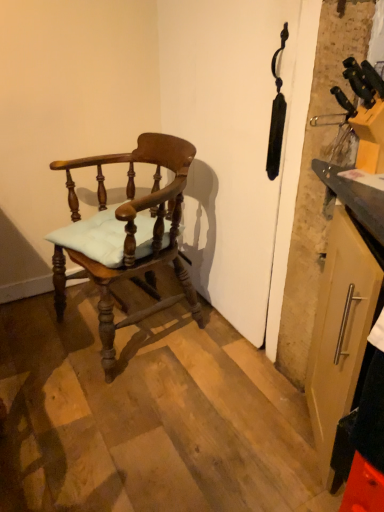
The width and height of the screenshot is (384, 512). What do you see at coordinates (340, 332) in the screenshot?
I see `matte silver handle on the right` at bounding box center [340, 332].

Image resolution: width=384 pixels, height=512 pixels. Identify the location of matte silver handle on the right. (340, 332).

Measure the distance between point [331,345] and camera.

They are 1.17 meters apart.

The image size is (384, 512). What do you see at coordinates (132, 234) in the screenshot?
I see `matte wood chair at left` at bounding box center [132, 234].

In order to face matte wood chair at left, should I rotate leftwards or rightwards?

Turn left by 8.425 degrees to look at matte wood chair at left.

At what (x,y) coordinates should I click in order to perform the action: click on matte wood chair at left. Please return your answer as a coordinate pair (x, y). Looking at the image, I should click on (132, 234).

The width and height of the screenshot is (384, 512). Find the location of `matte silver handle on the right`. matte silver handle on the right is located at coordinates (340, 332).

Between matte silver handle on the right and matte wood chair at left, which one appears on the left side from the viewer's perspective?

matte wood chair at left.

Considering their positions, is matte silver handle on the right located in front of or behind matte wood chair at left?

Clearly, matte silver handle on the right is in front of matte wood chair at left.

Is point (360, 236) closer or farther from the camera than point (128, 196)?

Point (360, 236) is closer to the camera than point (128, 196).

Based on the photo, from the image's perspective, is matte silver handle on the right below matte wood chair at left?

Yes, from the image's perspective, matte silver handle on the right is below matte wood chair at left.

From a real-world perspective, is matte silver handle on the right physically located above or below matte wood chair at left?

In terms of real-world spatial position, matte silver handle on the right is above matte wood chair at left.

Does matte silver handle on the right have a lesser width compared to matte wood chair at left?

Indeed, matte silver handle on the right has a lesser width compared to matte wood chair at left.

Is matte silver handle on the right shorter than matte wood chair at left?

Indeed, matte silver handle on the right has a lesser height compared to matte wood chair at left.

In terms of size, does matte silver handle on the right appear bigger or smaller than matte wood chair at left?

In the image, matte silver handle on the right appears to be smaller than matte wood chair at left.

Would you say matte wood chair at left is part of matte silver handle on the right's contents?

Actually, matte wood chair at left is outside matte silver handle on the right.

Is matte silver handle on the right far from matte wood chair at left?

matte silver handle on the right is near matte wood chair at left, not far away.

Is matte silver handle on the right facing towards matte wood chair at left?

No, matte silver handle on the right is not oriented towards matte wood chair at left.

How different are the orientations of matte silver handle on the right and matte wood chair at left in degrees?

There is a 9.81-degree angle between the facing directions of matte silver handle on the right and matte wood chair at left.

How distant is matte silver handle on the right from matte wood chair at left?

matte silver handle on the right is 32.03 inches from matte wood chair at left.

Identify the location of chair above the matte silver handle on the right (from the image's perspective). Image resolution: width=384 pixels, height=512 pixels. (132, 234).

Between matte wood chair at left and matte silver handle on the right, which one appears on the right side from the viewer's perspective?

matte silver handle on the right.

Relative to matte silver handle on the right, is matte wood chair at left in front or behind?

matte wood chair at left is behind matte silver handle on the right.

Is point (157, 141) closer or farther from the camera than point (318, 436)?

Point (157, 141) appears to be farther away from the viewer than point (318, 436).

From the image's perspective, is matte wood chair at left located beneath matte silver handle on the right?

Incorrect, from the image's perspective, matte wood chair at left is higher than matte silver handle on the right.

From a real-world perspective, is matte wood chair at left physically below matte silver handle on the right?

Indeed, from a real-world perspective, matte wood chair at left is positioned beneath matte silver handle on the right.

Looking at this image, between matte wood chair at left and matte silver handle on the right, which one has smaller width?

matte silver handle on the right.

Considering the sizes of objects matte wood chair at left and matte silver handle on the right in the image provided, who is shorter, matte wood chair at left or matte silver handle on the right?

Standing shorter between the two is matte silver handle on the right.

Based on the photo, can you confirm if matte wood chair at left is bigger than matte silver handle on the right?

Yes, matte wood chair at left is bigger than matte silver handle on the right.

Is matte wood chair at left outside of matte silver handle on the right?

Indeed, matte wood chair at left is completely outside matte silver handle on the right.

Is matte wood chair at left in contact with matte silver handle on the right?

There is a gap between matte wood chair at left and matte silver handle on the right.

Does matte wood chair at left turn towards matte silver handle on the right?

No, matte wood chair at left does not turn towards matte silver handle on the right.

Can you tell me how much matte wood chair at left and matte silver handle on the right differ in facing direction?

The angle between the facing direction of matte wood chair at left and the facing direction of matte silver handle on the right is 9.81 degrees.

This screenshot has height=512, width=384. I want to click on chair behind the matte silver handle on the right, so click(x=132, y=234).

You are a GUI agent. You are given a task and a screenshot of the screen. Output one action in this format:
    pyautogui.click(x=<x>, y=<y>)
    Task: Click on the chair above the matte silver handle on the right (from the image's perspective)
    The width and height of the screenshot is (384, 512).
    Given the screenshot: What is the action you would take?
    pyautogui.click(x=132, y=234)

The height and width of the screenshot is (512, 384). I want to click on cabinetry located in front of the matte wood chair at left, so tap(340, 332).